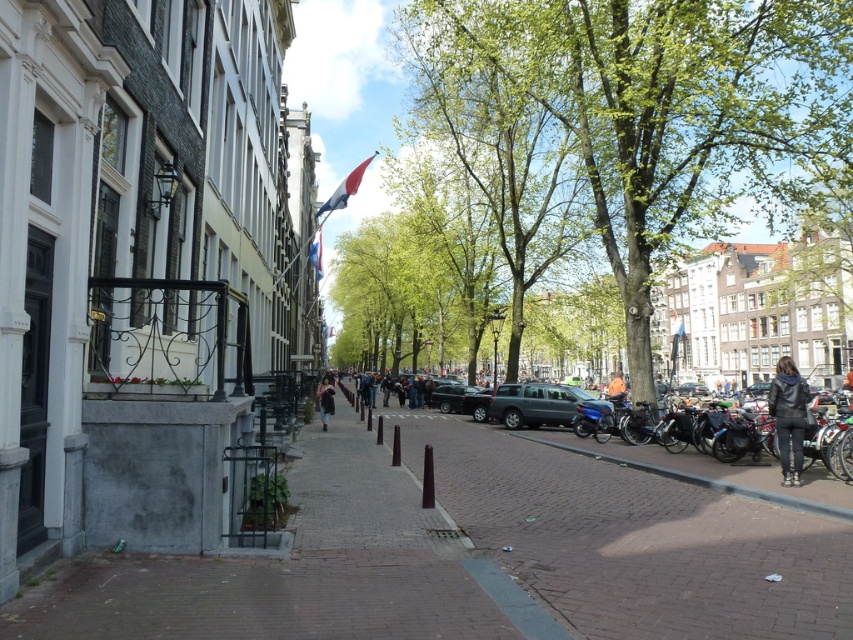
Does metallic gray suv at center come behind shiny black car at center?

No, metallic gray suv at center is closer to the viewer.

Which is in front, point (585, 394) or point (471, 390)?

Point (585, 394) is in front.

Between point (500, 417) and point (444, 400), which one is positioned in front?

Point (500, 417) is in front.

At what (x,y) coordinates should I click in order to perform the action: click on metallic gray suv at center. Please return your answer as a coordinate pair (x, y). The image size is (853, 640). Looking at the image, I should click on (535, 404).

Can you confirm if brick pavement at center is shorter than orange fabric jacket at center?

Yes, brick pavement at center is shorter than orange fabric jacket at center.

Can you confirm if brick pavement at center is bigger than orange fabric jacket at center?

No.

The height and width of the screenshot is (640, 853). Describe the element at coordinates (635, 540) in the screenshot. I see `brick pavement at center` at that location.

Where is `brick pavement at center`? brick pavement at center is located at coordinates (635, 540).

Is metallic gray suv at center further to camera compared to orange fabric jacket at center?

No, metallic gray suv at center is in front of orange fabric jacket at center.

Does metallic gray suv at center have a smaller size compared to orange fabric jacket at center?

Yes, metallic gray suv at center is smaller than orange fabric jacket at center.

What do you see at coordinates (535, 404) in the screenshot?
I see `metallic gray suv at center` at bounding box center [535, 404].

Identify the location of metallic gray suv at center. The width and height of the screenshot is (853, 640). (535, 404).